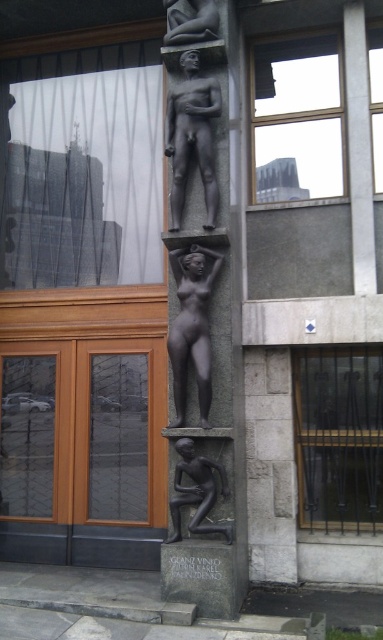
Question: Can you confirm if polished bronze statue at center is positioned to the right of black wrought iron bars at right?

Choices:
 (A) yes
 (B) no

Answer: (B)

Question: Which object appears farthest from the camera in this image?

Choices:
 (A) black wrought iron bars at right
 (B) polished bronze statue at center
 (C) bronze statue at center
 (D) matte bronze statue at upper center

Answer: (A)

Question: Which is nearer to the black wrought iron bars at right?

Choices:
 (A) transparent glass window at upper center
 (B) matte bronze statue at upper center
 (C) bronze figure at lower center
 (D) bronze statue at center

Answer: (C)

Question: Can you confirm if transparent glass window at upper center is positioned to the left of bronze figure at lower center?

Choices:
 (A) no
 (B) yes

Answer: (A)

Question: Can you confirm if polished bronze statue at center is smaller than black wrought iron bars at right?

Choices:
 (A) no
 (B) yes

Answer: (A)

Question: Which of the following is the closest to the observer?

Choices:
 (A) polished bronze statue at center
 (B) bronze statue at center

Answer: (A)